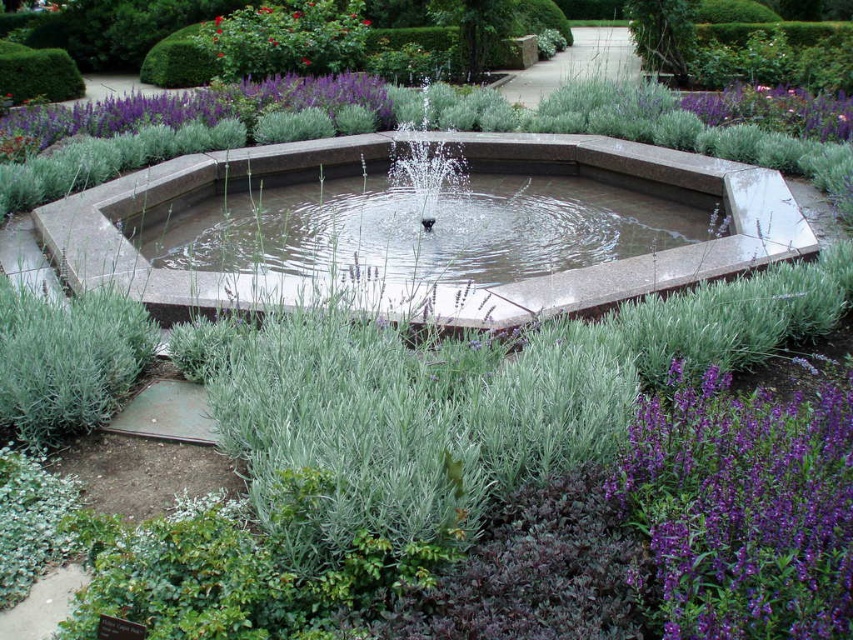
Is the position of purple soft-textured lavender at lower right more distant than that of purple soft lavender at upper right?

That is False.

Can you confirm if purple soft-textured lavender at lower right is positioned below purple soft lavender at upper right?

Indeed, purple soft-textured lavender at lower right is positioned under purple soft lavender at upper right.

Does point (778, 410) come behind point (749, 120)?

No, (778, 410) is closer to viewer.

Locate an element on the screen. This screenshot has width=853, height=640. purple soft-textured lavender at lower right is located at coordinates (741, 508).